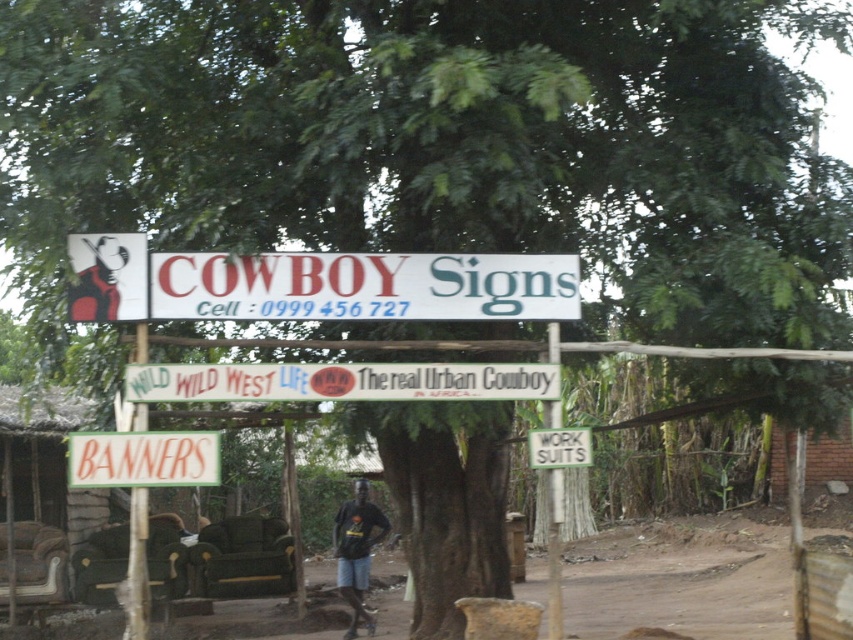
Find the location of a particular element. The width and height of the screenshot is (853, 640). green fabric banner at left is located at coordinates (42, 493).

Can you confirm if green fabric banner at left is thinner than orange matte banners at center?

Incorrect, green fabric banner at left's width is not less than orange matte banners at center's.

Is point (78, 493) closer to camera compared to point (138, 432)?

No, (78, 493) is further to viewer.

Find the location of a particular element. green fabric banner at left is located at coordinates (42, 493).

Who is positioned more to the left, brown dirt field at lower center or orange matte banners at center?

Positioned to the left is orange matte banners at center.

Is brown dirt field at lower center smaller than orange matte banners at center?

Actually, brown dirt field at lower center might be larger than orange matte banners at center.

Between point (596, 637) and point (200, 484), which one is positioned in front?

Point (200, 484) is more forward.

Identify the location of brown dirt field at lower center. (682, 579).

Does white plastic signboard at center have a smaller size compared to dark blue fabric shirt at center?

Yes, white plastic signboard at center is smaller than dark blue fabric shirt at center.

Can you confirm if white plastic signboard at center is bigger than dark blue fabric shirt at center?

No, white plastic signboard at center is not bigger than dark blue fabric shirt at center.

Which is behind, point (488, 284) or point (369, 509)?

Positioned behind is point (369, 509).

At what (x,y) coordinates should I click in order to perform the action: click on white plastic signboard at center. Please return your answer as a coordinate pair (x, y). This screenshot has width=853, height=640. Looking at the image, I should click on (363, 285).